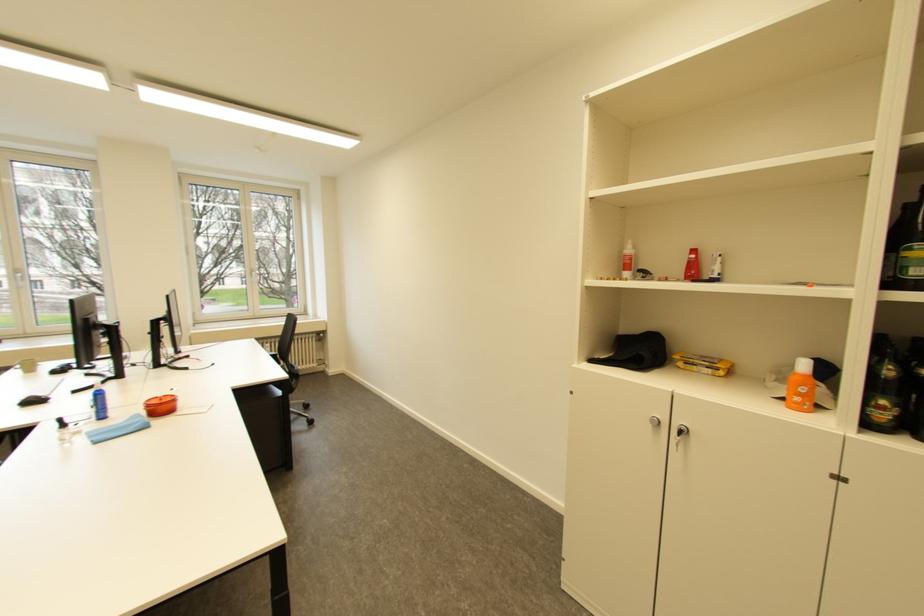
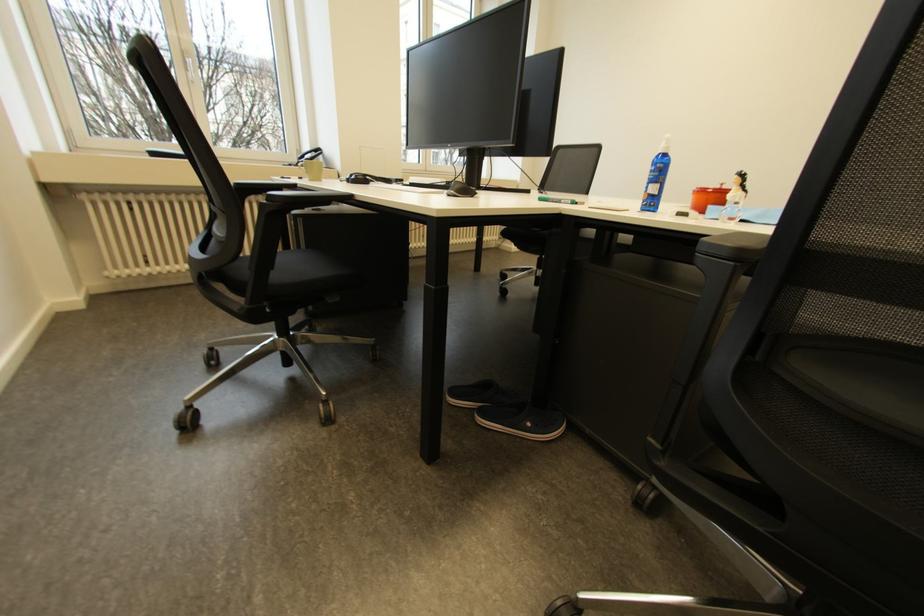
Question: In a continuous first-person perspective shot, in which direction is the camera moving?

Choices:
 (A) Left
 (B) Right
 (C) Forward
 (D) Backward

Answer: (A)